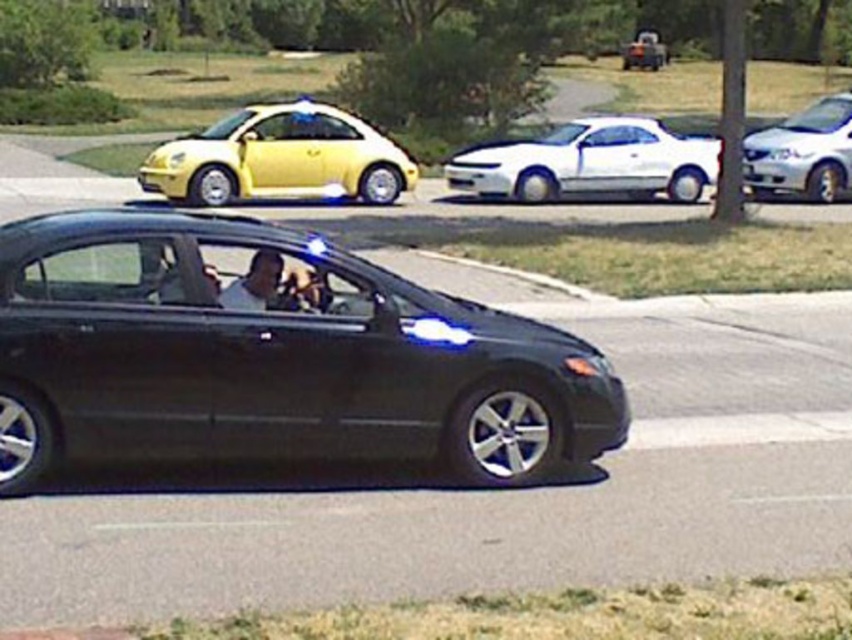
You are a pedestrian standing at the intersection and want to cross the street. There is a white glossy sedan at upper right and a metallic silver truck at upper center. Which vehicle is closer to the left side of the street?

The white glossy sedan at upper right is to the left of the metallic silver truck at upper center, so it is closer to the left side of the street.

You are a pedestrian standing at the edge of the road and see the glossy black sedan at center and the white glossy sedan at upper right. Which car is nearer to you?

The glossy black sedan at center is closer to the viewer than the white glossy sedan at upper right, so the glossy black sedan at center is nearer to you.